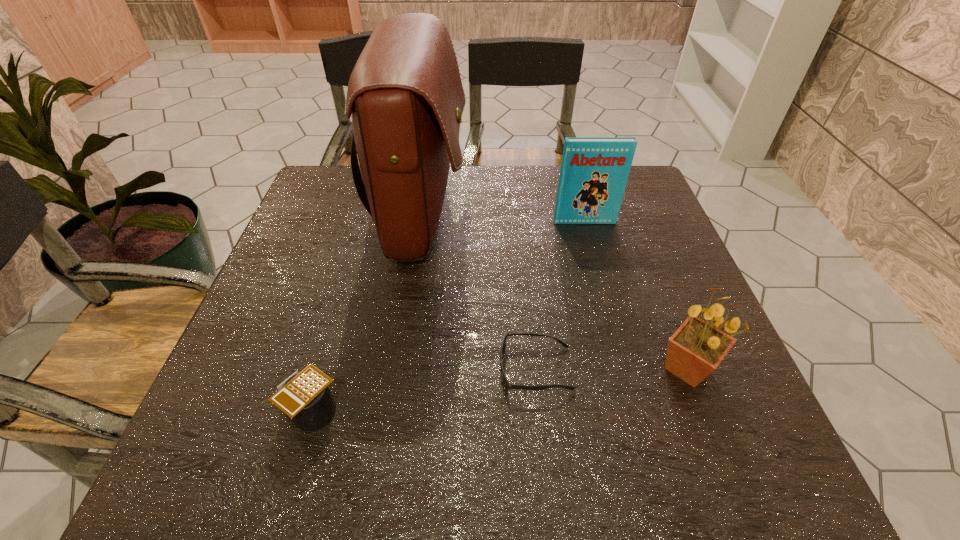
Where is `vacant area in the image that satisfies the following two spatial constraints: 1. on the front cover of the book; 2. on the front-facing side of the shortest object`? This screenshot has height=540, width=960. vacant area in the image that satisfies the following two spatial constraints: 1. on the front cover of the book; 2. on the front-facing side of the shortest object is located at coordinates (624, 369).